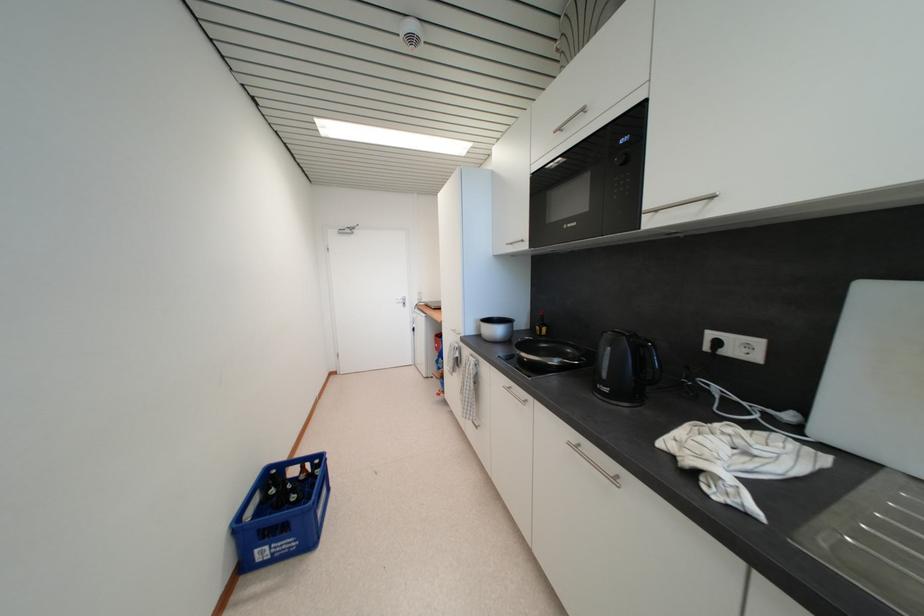
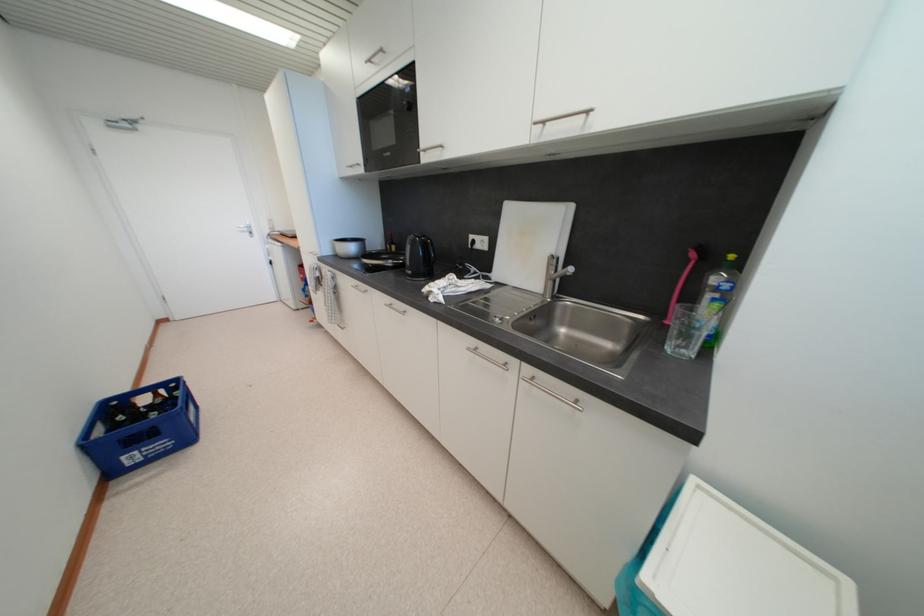
The point at (612,392) is marked in the first image. Where is the corresponding point in the second image?

(415, 275)